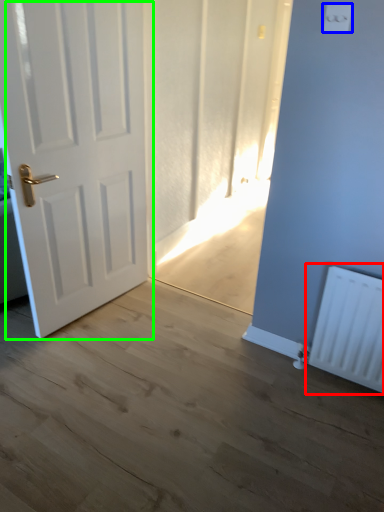
Question: Considering the real-world distances, which object is closest to radiator (highlighted by a red box)? light switch (highlighted by a blue box) or door (highlighted by a green box).

Choices:
 (A) light switch
 (B) door

Answer: (A)